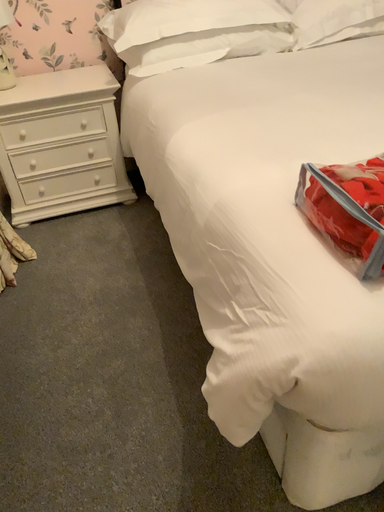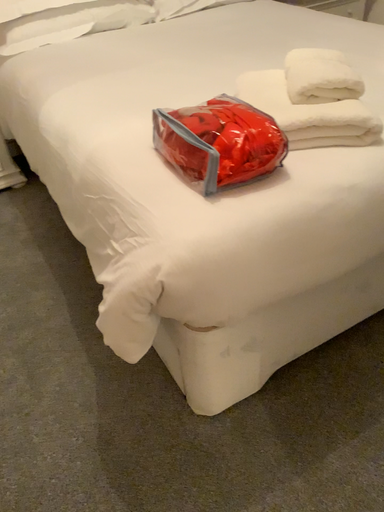
Question: Which way did the camera rotate in the video?

Choices:
 (A) rotated left
 (B) rotated right

Answer: (B)